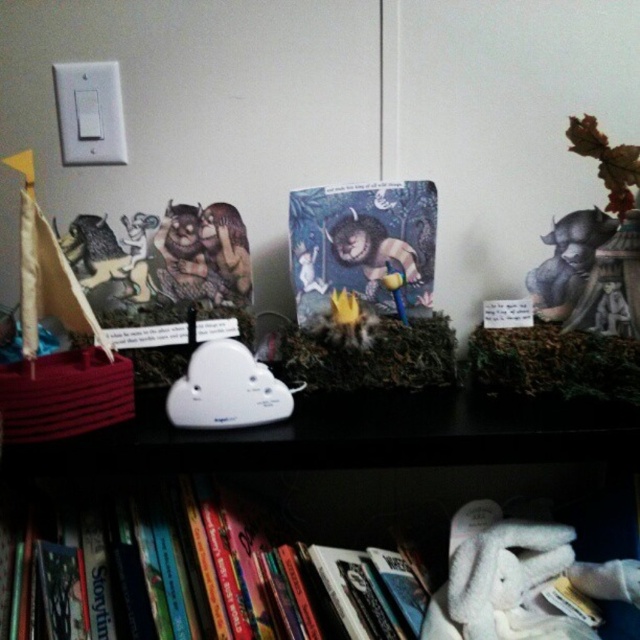
Question: Which object is positioned closest to the white plastic cloud at center?

Choices:
 (A) hardcover books at center
 (B) hardcover book at lower left

Answer: (A)

Question: Which object is the farthest from the hardcover books at center?

Choices:
 (A) hardcover book at lower left
 (B) white plastic cloud at center

Answer: (A)

Question: Can you confirm if hardcover book at lower left is positioned above hardcover books at center?

Choices:
 (A) yes
 (B) no

Answer: (B)

Question: Which of the following is the farthest from the observer?

Choices:
 (A) (301, 604)
 (B) (60, 444)
 (C) (275, 420)

Answer: (C)

Question: Does hardcover book at lower left lie behind white plastic cloud at center?

Choices:
 (A) yes
 (B) no

Answer: (B)

Question: Does hardcover book at lower left have a larger size compared to hardcover books at center?

Choices:
 (A) no
 (B) yes

Answer: (B)